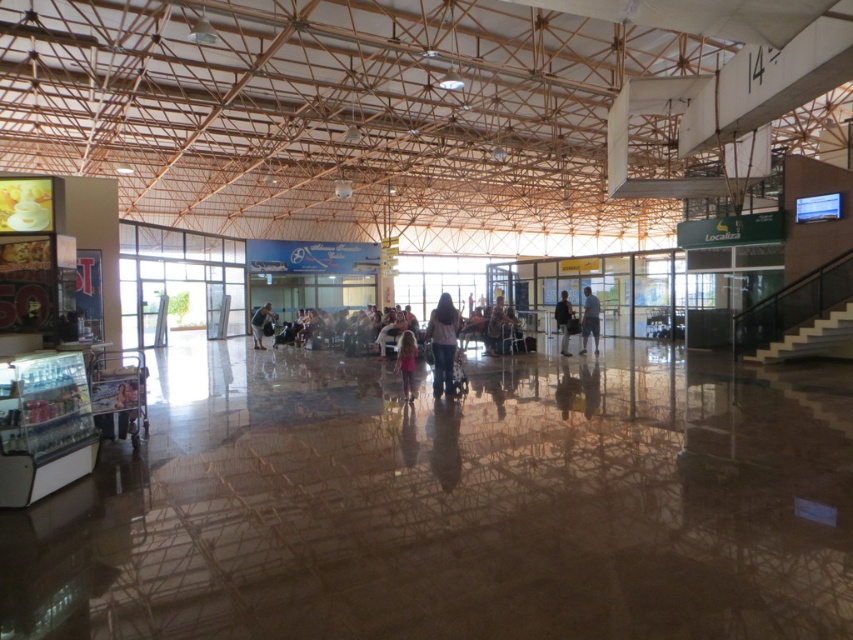
You are standing at the entrance of the airport terminal and want to reach the staircase leading upwards. You have a luggage cart that can move up to 10 meters. The point where the staircase starts is marked as point (439, 365). Can your luggage cart reach the staircase from your current position?

The distance of point (439, 365) from camera is 11.12 meters, so the luggage cart cannot reach the staircase as it exceeds the cart maximum distance of 10 meters.